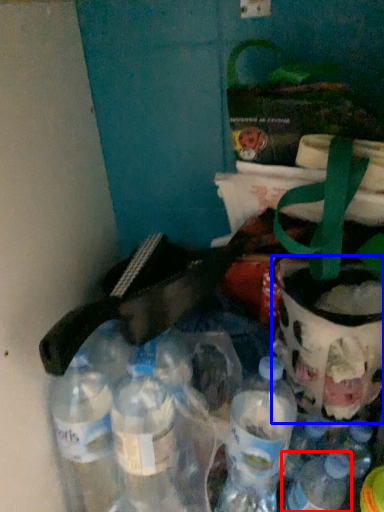
Question: Among these objects, which one is nearest to the camera, bottle (highlighted by a red box) or glass jar (highlighted by a blue box)?

Choices:
 (A) bottle
 (B) glass jar

Answer: (A)